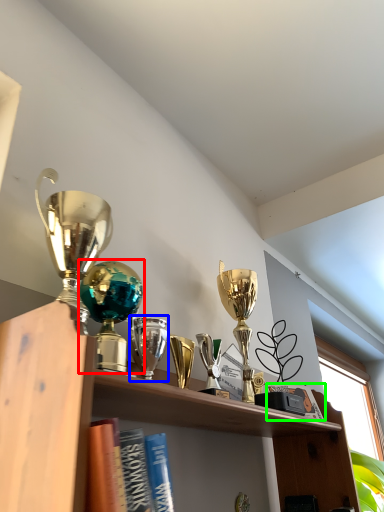
Question: Which is farther away from trophy (highlighted by a red box)? trophy (highlighted by a blue box) or book (highlighted by a green box)?

Choices:
 (A) trophy
 (B) book

Answer: (B)